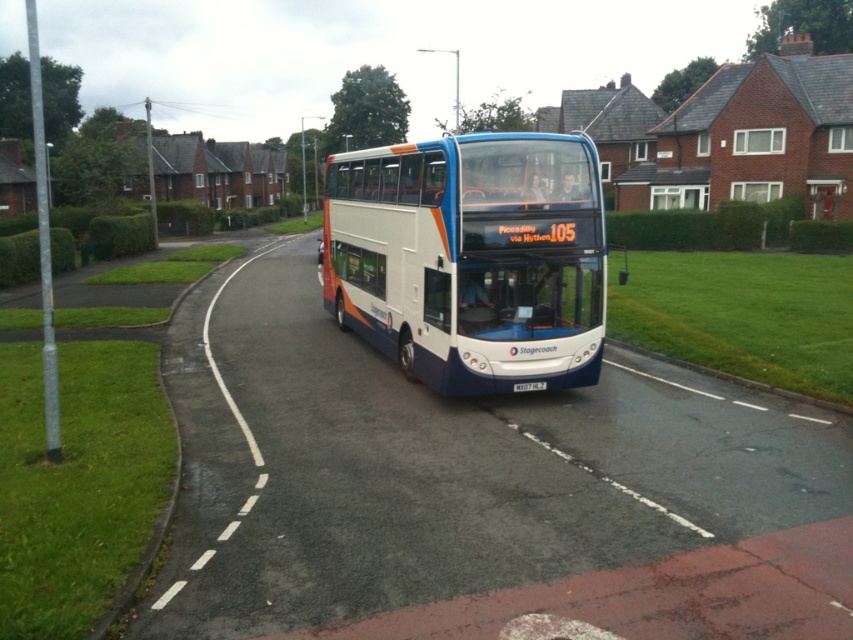
Which of these two, white glossy decker bus at center or white plastic license plate at center, stands shorter?

With less height is white plastic license plate at center.

Who is lower down, white glossy decker bus at center or white plastic license plate at center?

Positioned lower is white plastic license plate at center.

What do you see at coordinates (469, 257) in the screenshot? I see `white glossy decker bus at center` at bounding box center [469, 257].

What are the coordinates of `white glossy decker bus at center` in the screenshot? It's located at (469, 257).